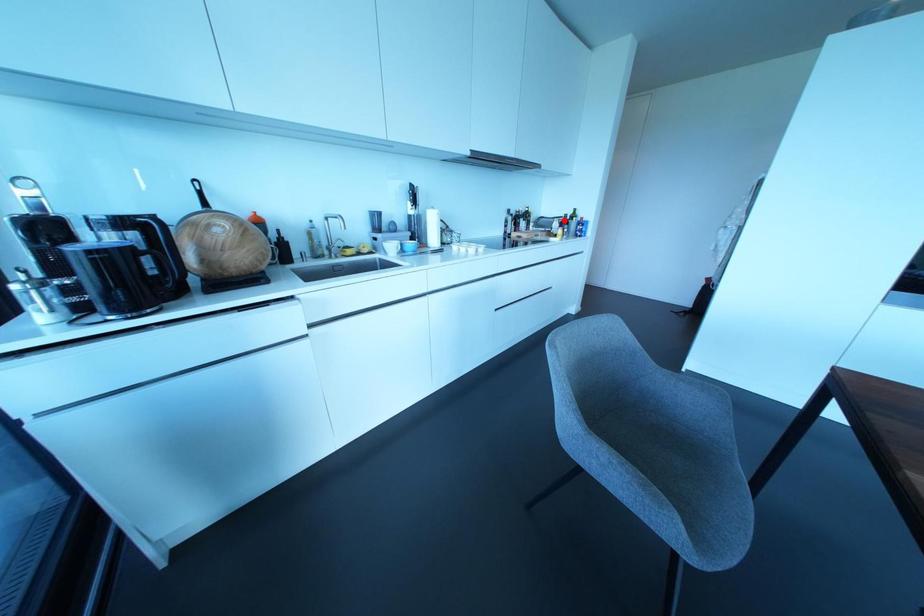
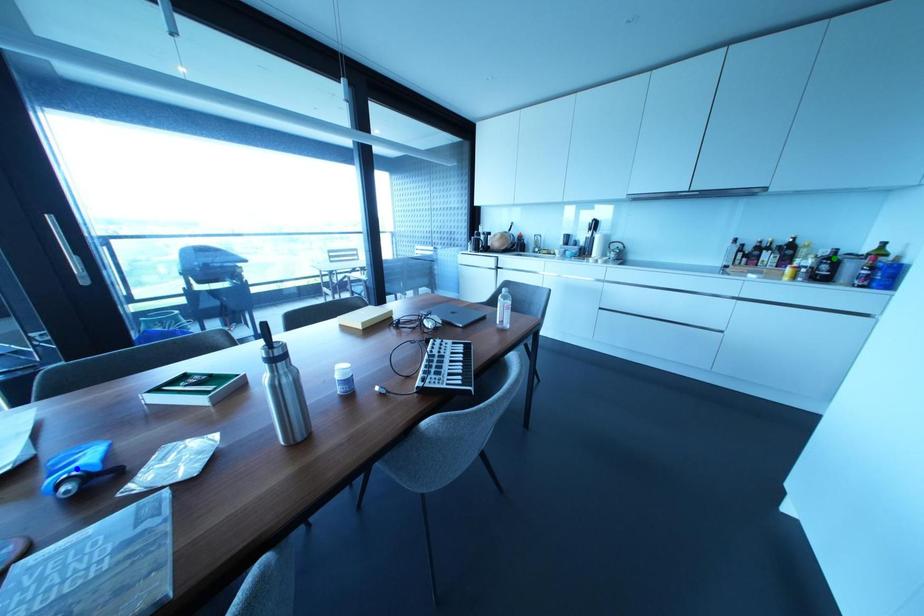
Question: I am providing you with two images of the same scene from different viewpoints. A red point is marked on the first image. You are given multiple points on the second image. Can you choose the point in image 2 that corresponds to the point in image 1?

Choices:
 (A) yellow point
 (B) blue point
 (C) green point

Answer: (C)